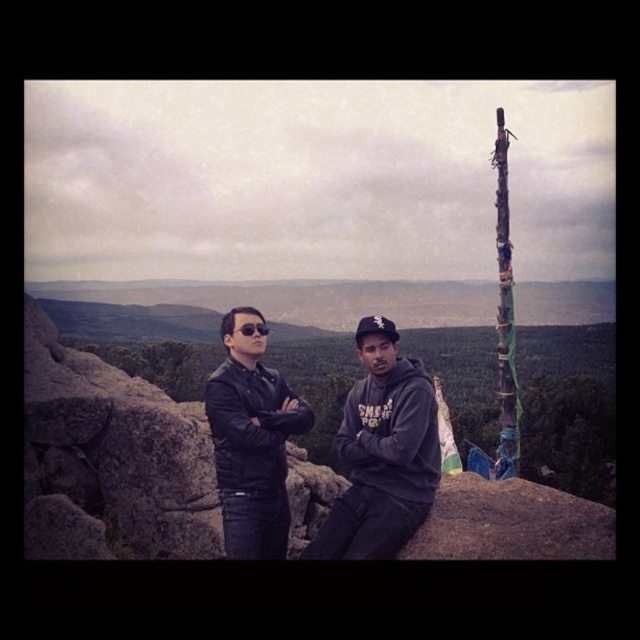
Question: Which object is closer to the camera taking this photo?

Choices:
 (A) carved wooden totem pole at right
 (B) dark gray hoodie at center

Answer: (B)

Question: Can you confirm if leather jacket at center is positioned below carved wooden totem pole at right?

Choices:
 (A) no
 (B) yes

Answer: (B)

Question: Is dark gray hoodie at center positioned in front of leather jacket at center?

Choices:
 (A) no
 (B) yes

Answer: (B)

Question: Which point appears farthest from the camera in this image?

Choices:
 (A) (500, 310)
 (B) (289, 419)
 (C) (356, 413)

Answer: (A)

Question: Is leather jacket at center further to the viewer compared to carved wooden totem pole at right?

Choices:
 (A) no
 (B) yes

Answer: (A)

Question: Which object appears farthest from the camera in this image?

Choices:
 (A) carved wooden totem pole at right
 (B) leather jacket at center
 (C) dark gray hoodie at center

Answer: (A)